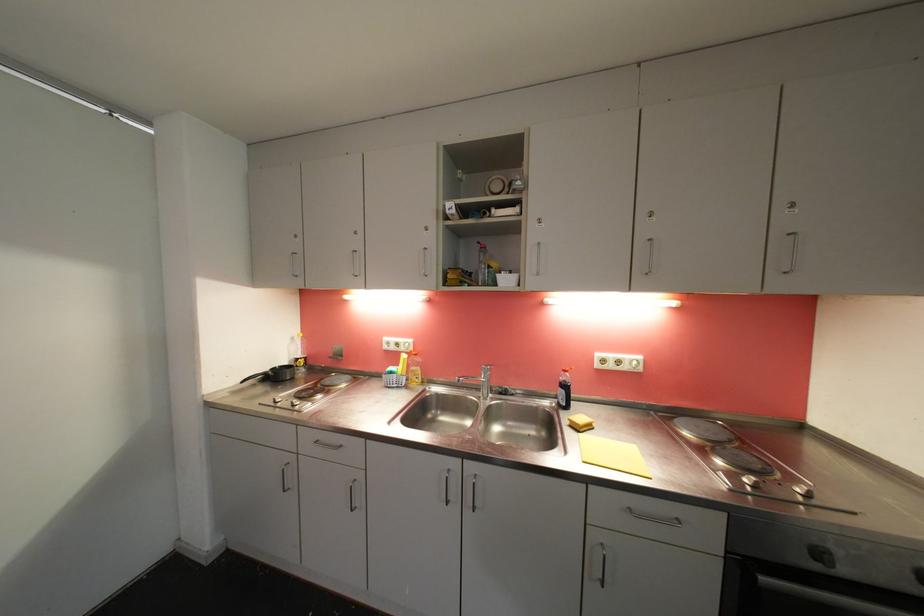
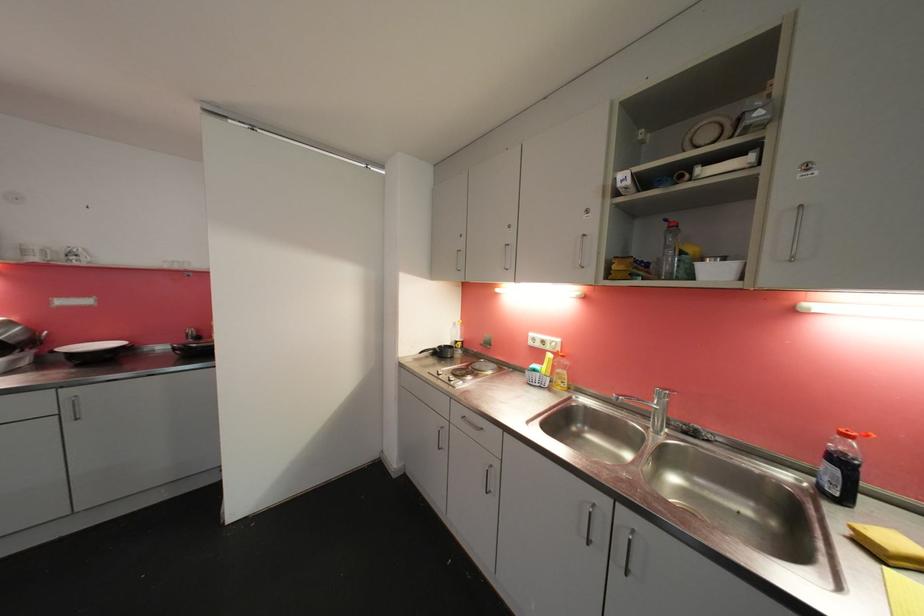
Where in the second image is the point corresponding to (503,278) from the first image?

(703, 267)